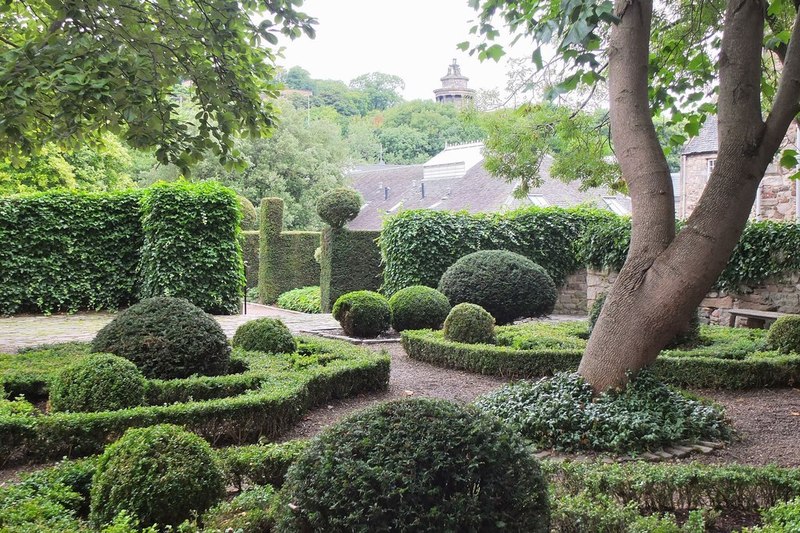
You are a GUI agent. You are given a task and a screenshot of the screen. Output one action in this format:
    pyautogui.click(x=<x>, y=<y>)
    Task: Click on the bench
    The image size is (800, 533).
    Given the screenshot: What is the action you would take?
    pyautogui.click(x=752, y=317)